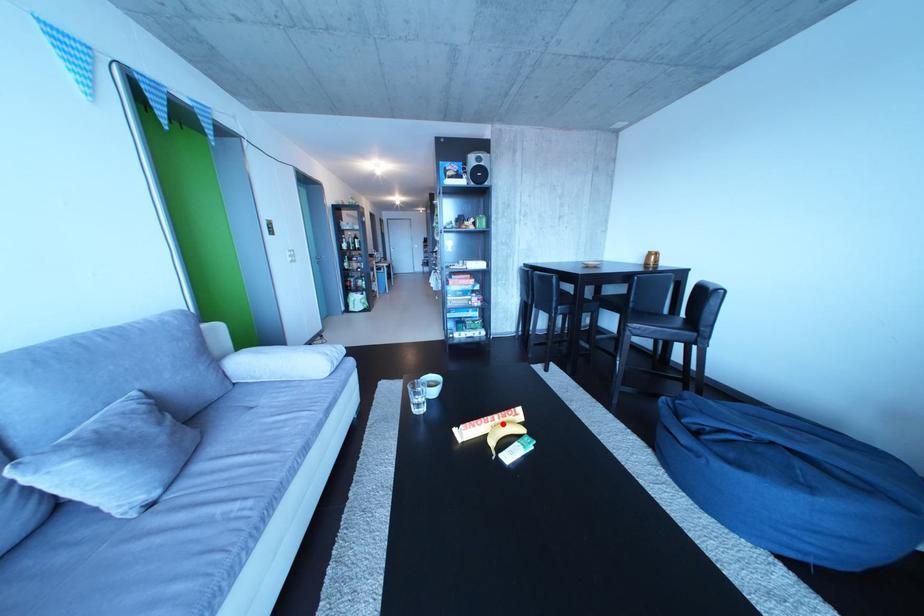
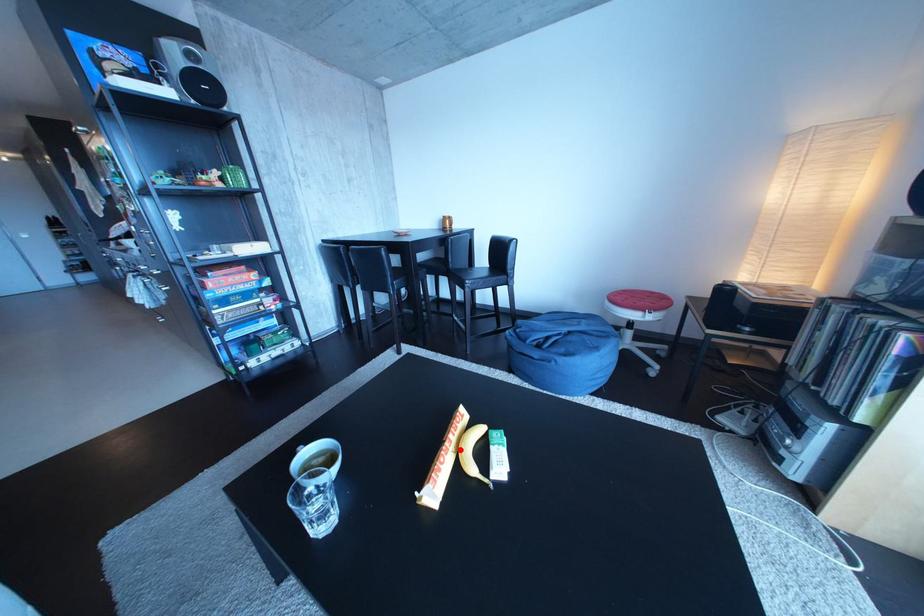
I am providing you with two images of the same scene from different viewpoints. A red point is marked on the first image and another point is marked on the second image. Does the point marked in image1 correspond to the same location as the one in image2?

Yes